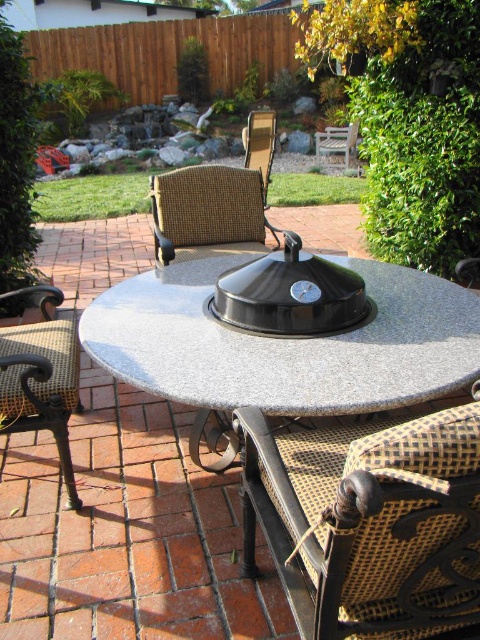
Question: Which of these objects is positioned farthest from the woven fabric armchair at lower right?

Choices:
 (A) granite table at center
 (B) black wrought iron armchair at left
 (C) wooden armchair at center

Answer: (C)

Question: Observing the image, what is the correct spatial positioning of woven fabric armchair at lower right in reference to woven fabric armchair at center?

Choices:
 (A) left
 (B) right

Answer: (B)

Question: Is woven fabric armchair at center positioned in front of wooden armchair at center?

Choices:
 (A) yes
 (B) no

Answer: (A)

Question: Estimate the real-world distances between objects in this image. Which object is closer to the woven fabric armchair at lower right?

Choices:
 (A) wooden armchair at center
 (B) granite table at center

Answer: (B)

Question: Among these points, which one is nearest to the camera?

Choices:
 (A) (192, 257)
 (B) (157, 392)
 (C) (464, 460)

Answer: (C)

Question: In this image, where is granite table at center located relative to woven fabric armchair at center?

Choices:
 (A) right
 (B) left

Answer: (A)